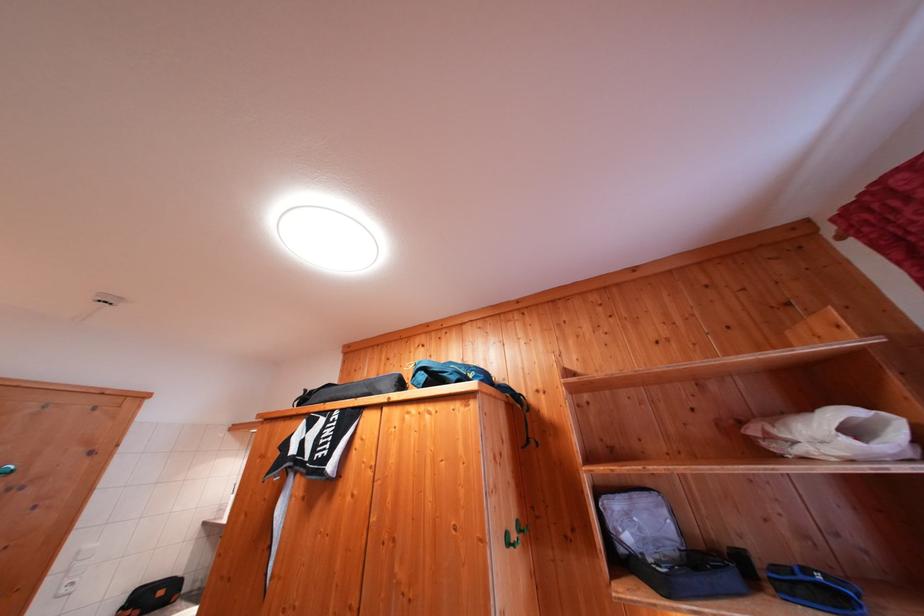
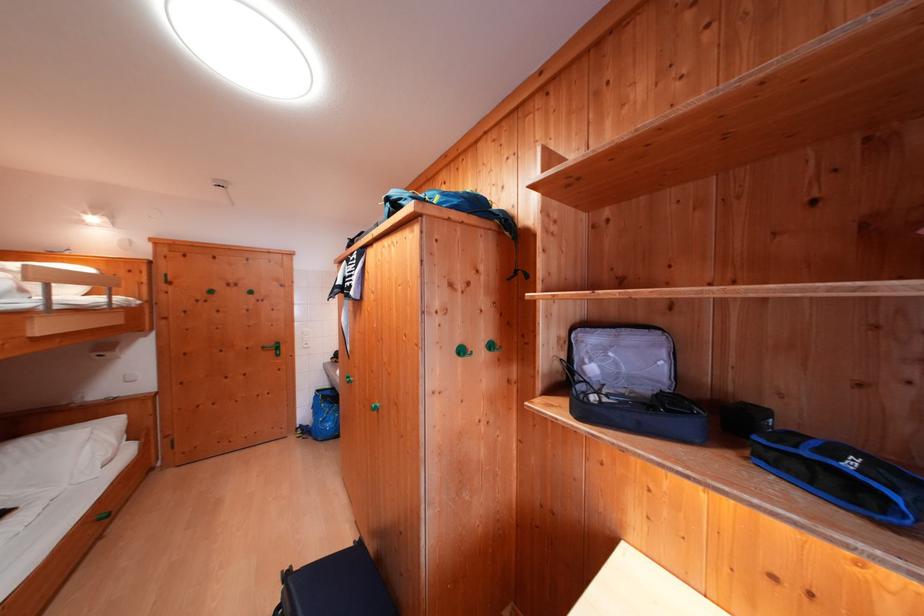
Find the pixel in the second image that matches (x=811, y=582) in the first image.

(815, 456)